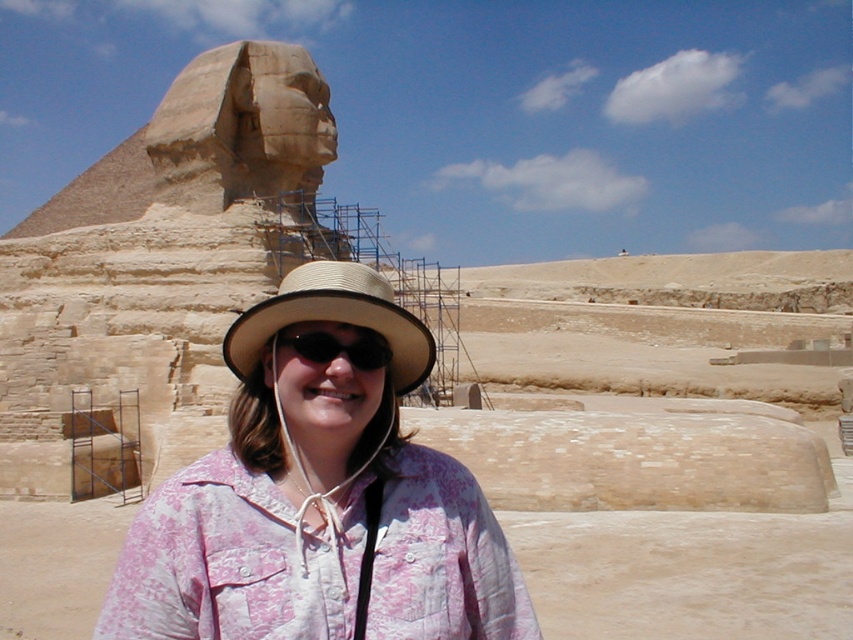
Based on the photo, is pink floral shirt at center thinner than straw hat at center?

No.

Is point (265, 310) closer to viewer compared to point (364, 298)?

No, (265, 310) is further to viewer.

Image resolution: width=853 pixels, height=640 pixels. What are the coordinates of `pink floral shirt at center` in the screenshot? It's located at (318, 497).

The image size is (853, 640). What do you see at coordinates (318, 497) in the screenshot?
I see `pink floral shirt at center` at bounding box center [318, 497].

Who is shorter, pink floral shirt at center or beige stone sphinx at upper left?

pink floral shirt at center is shorter.

Does point (283, 481) lie in front of point (67, 184)?

Yes, point (283, 481) is in front of point (67, 184).

Where is `pink floral shirt at center`? The width and height of the screenshot is (853, 640). pink floral shirt at center is located at coordinates point(318,497).

Between beige stone sphinx at upper left and black plastic goggles at center, which one appears on the right side from the viewer's perspective?

black plastic goggles at center is more to the right.

Consider the image. Can you confirm if beige stone sphinx at upper left is thinner than black plastic goggles at center?

Incorrect, beige stone sphinx at upper left's width is not less than black plastic goggles at center's.

The width and height of the screenshot is (853, 640). Find the location of `beige stone sphinx at upper left`. beige stone sphinx at upper left is located at coordinates (209, 138).